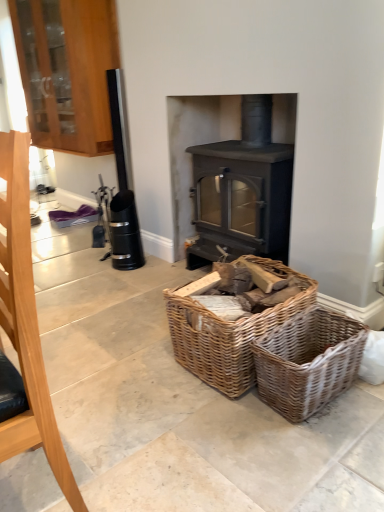
Locate an element on the screen. vacant region to the left of matte gray wood burning stove at center is located at coordinates (147, 285).